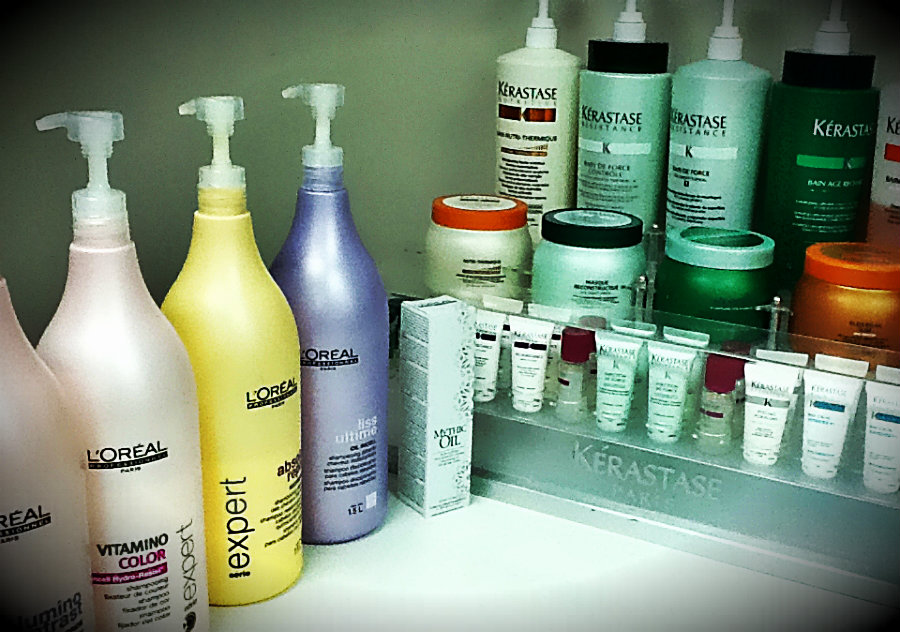
Find the location of a particular element. Image resolution: width=900 pixels, height=632 pixels. jars is located at coordinates (488, 237), (603, 248), (720, 289), (856, 301).